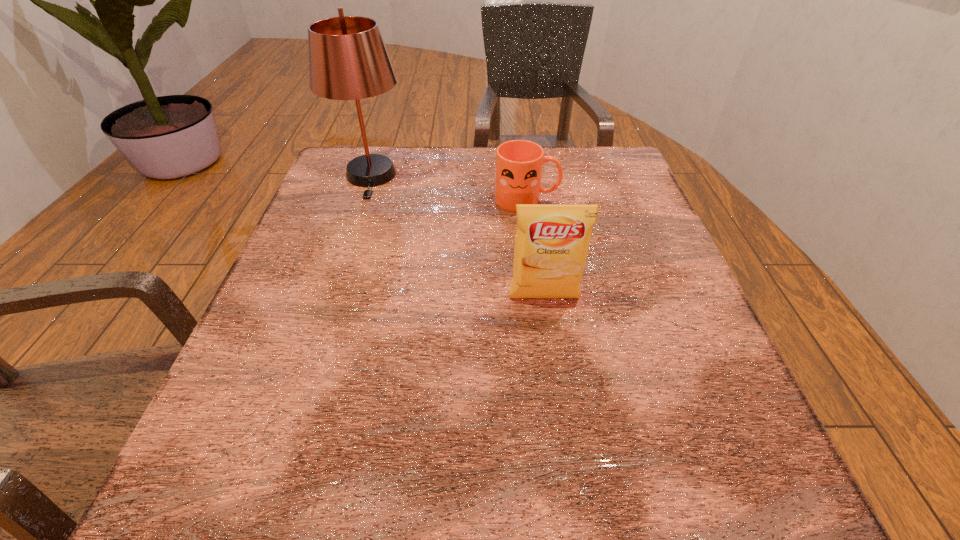
I want to click on lampshade, so click(x=348, y=60).

The height and width of the screenshot is (540, 960). What are the coordinates of `the tallest object` in the screenshot? It's located at (348, 60).

This screenshot has height=540, width=960. I want to click on the nearest object, so click(552, 240).

Identify the location of crisp (potato chip). The image size is (960, 540). (552, 240).

Identify the location of mug. The image size is (960, 540). (519, 163).

Locate an element on the screen. This screenshot has width=960, height=540. free space located 0.160m on the front-facing side of the lampshade is located at coordinates (348, 245).

You are a GUI agent. You are given a task and a screenshot of the screen. Output one action in this format:
    pyautogui.click(x=<x>, y=<y>)
    Task: Click on the vacant area situated 0.220m on the front of the nearest object with the logo
    The width and height of the screenshot is (960, 540).
    Given the screenshot: What is the action you would take?
    pyautogui.click(x=563, y=426)

At what (x,y) coordinates should I click in order to perform the action: click on free point located on the handle side of the shortest object. Please return your answer as a coordinate pair (x, y). Image resolution: width=960 pixels, height=540 pixels. Looking at the image, I should click on (642, 200).

Image resolution: width=960 pixels, height=540 pixels. I want to click on lampshade situated at the far edge, so click(348, 60).

Identify the location of mug present at the far edge. (519, 163).